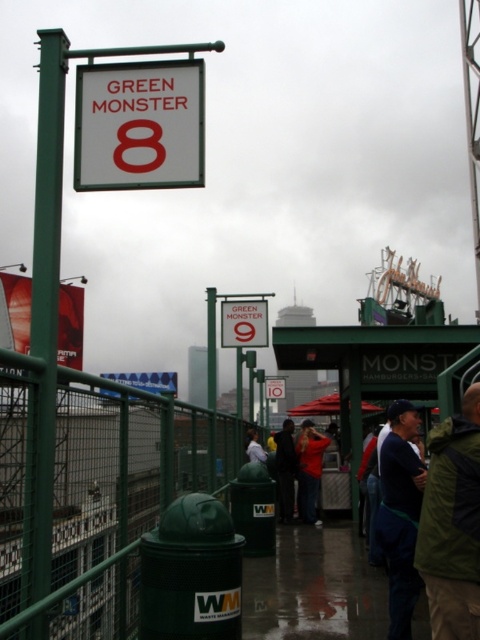
Question: Which object appears farthest from the camera in this image?

Choices:
 (A) green matte pole at left
 (B) white plastic sign at upper center
 (C) dark blue jacket at center

Answer: (C)

Question: Which of the following is the closest to the observer?

Choices:
 (A) dark blue jacket at center
 (B) dark fabric coat at center

Answer: (B)

Question: Is green matte jacket at lower right above dark blue jacket at lower right?

Choices:
 (A) no
 (B) yes

Answer: (B)

Question: Is green metal fence at lower left further to camera compared to dark blue jacket at center?

Choices:
 (A) no
 (B) yes

Answer: (A)

Question: Is white plastic sign at upper center further to camera compared to dark blue jacket at lower right?

Choices:
 (A) no
 (B) yes

Answer: (A)

Question: Considering the real-world distances, which object is closest to the dark fabric coat at center?

Choices:
 (A) red jacket at center
 (B) dark blue jacket at center
 (C) green matte jacket at lower right

Answer: (A)